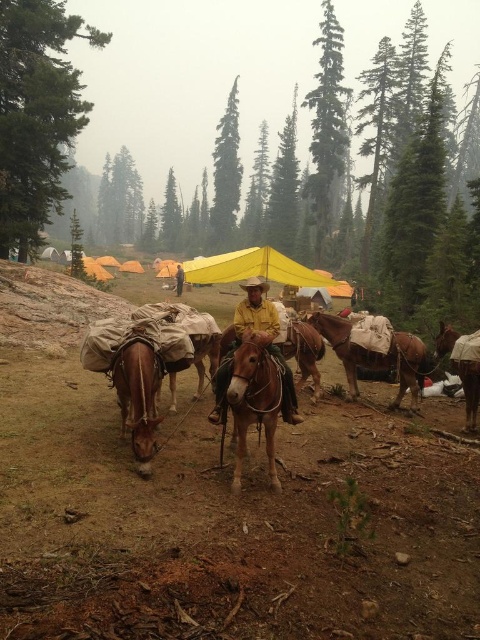
Question: Is brown leather saddle at lower right to the left of brown leather jacket at center from the viewer's perspective?

Choices:
 (A) yes
 (B) no

Answer: (B)

Question: Does brown leather saddle at center appear over yellow matte shirt at center?

Choices:
 (A) yes
 (B) no

Answer: (B)

Question: Can you confirm if yellow matte shirt at center is bigger than brown leather saddle at lower right?

Choices:
 (A) no
 (B) yes

Answer: (A)

Question: Which object is closer to the camera taking this photo?

Choices:
 (A) brown leather horse at center
 (B) yellow fabric canopy at center
 (C) brown leather jacket at center

Answer: (A)

Question: Which point is farther to the camera?

Choices:
 (A) brown leather jacket at center
 (B) yellow matte shirt at center
 (C) brown leather horse at lower left

Answer: (A)

Question: Which object is positioned farthest from the brown leather horse at center?

Choices:
 (A) brown leather jacket at center
 (B) brown leather saddle at center
 (C) yellow matte shirt at center

Answer: (A)